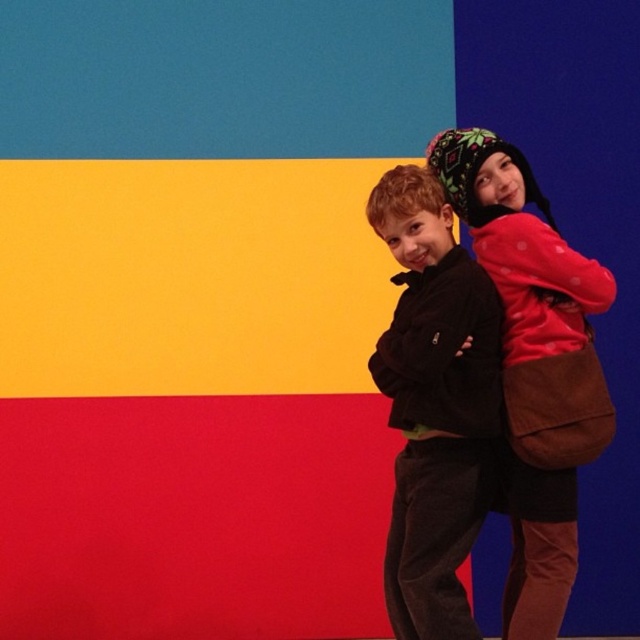
You are a tailor measuring jackets for two children. The first child is wearing a black fleece jacket at center, and the second child is wearing a matte red sweater at right. Which jacket has a smaller width?

The black fleece jacket at center has a smaller width than the matte red sweater at right according to the description.

You are a photographer trying to capture a clear shot of both the black fleece jacket at center and the matte red sweater at right. Based on their positions, which one should you focus on first to ensure both are in focus?

The black fleece jacket at center is closer to the viewer than the matte red sweater at right. To ensure both are in focus, you should focus on the black fleece jacket at center first, as it is the closer object, and adjust the depth of field accordingly.